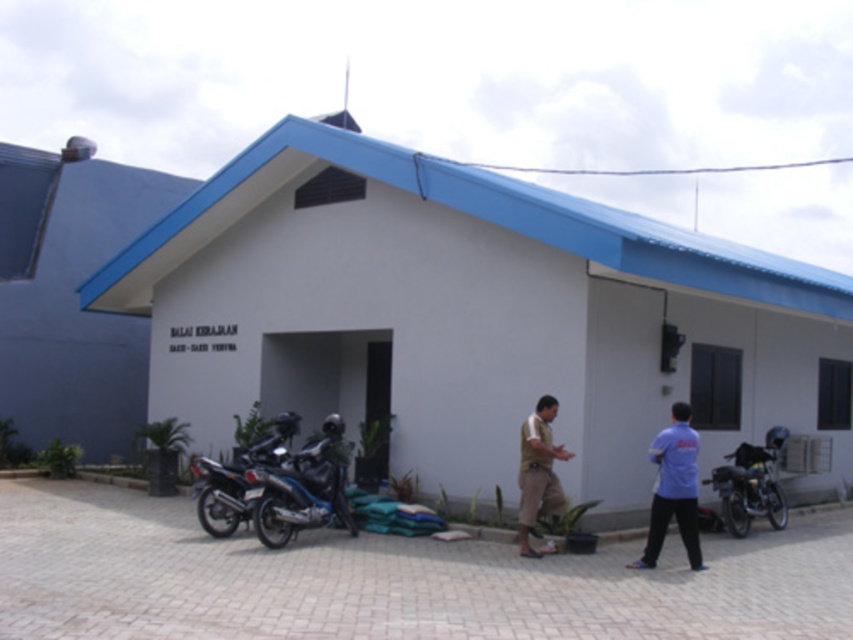
Question: Can you confirm if shiny metallic motorcycle at lower left is positioned below brown cotton shirt at center?

Choices:
 (A) yes
 (B) no

Answer: (B)

Question: Which of the following is the closest to the observer?

Choices:
 (A) (276, 429)
 (B) (729, 477)
 (C) (524, 474)
 (D) (672, 452)

Answer: (D)

Question: Which point is closer to the camera?

Choices:
 (A) shiny metallic motorcycle at lower left
 (B) blue cotton shirt at center
 (C) brown cotton shirt at center

Answer: (B)

Question: Can you confirm if blue cotton shirt at center is positioned below metallic silver motorcycle at center?

Choices:
 (A) yes
 (B) no

Answer: (B)

Question: Does shiny metallic motorcycle at lower left appear on the right side of brown cotton shirt at center?

Choices:
 (A) no
 (B) yes

Answer: (A)

Question: Which object appears farthest from the camera in this image?

Choices:
 (A) brown cotton shirt at center
 (B) blue cotton shirt at center

Answer: (A)